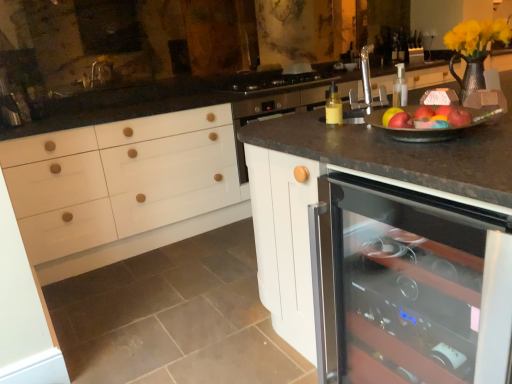
Question: Does red matte apple at upper right, the 1th apple from the right, have a greater height compared to black glass gas stove at center?

Choices:
 (A) yes
 (B) no

Answer: (B)

Question: Is red matte apple at upper right, the 1th apple from the right, to the left of black glass gas stove at center from the viewer's perspective?

Choices:
 (A) yes
 (B) no

Answer: (B)

Question: Considering the relative sizes of red matte apple at upper right, the 1th apple from the right, and black glass gas stove at center in the image provided, is red matte apple at upper right, the 1th apple from the right, wider than black glass gas stove at center?

Choices:
 (A) yes
 (B) no

Answer: (B)

Question: Is red matte apple at upper right, the 3th apple in the left-to-right sequence, next to black glass gas stove at center and touching it?

Choices:
 (A) no
 (B) yes

Answer: (A)

Question: Considering the relative sizes of red matte apple at upper right, the 1th apple from the right, and black glass gas stove at center in the image provided, is red matte apple at upper right, the 1th apple from the right, shorter than black glass gas stove at center?

Choices:
 (A) yes
 (B) no

Answer: (A)

Question: Which is correct: red matte apple at upper right, the 3th apple viewed from the right, is inside red matte apple at right, marked as the 2th apple in a left-to-right arrangement, or outside of it?

Choices:
 (A) inside
 (B) outside

Answer: (B)

Question: In terms of height, does red matte apple at upper right, the 3th apple viewed from the right, look taller or shorter compared to red matte apple at right, which is the 2th apple in right-to-left order?

Choices:
 (A) short
 (B) tall

Answer: (A)

Question: In the image, is red matte apple at upper right, arranged as the first apple when viewed from the left, on the left side or the right side of red matte apple at right, which is the 2th apple in right-to-left order?

Choices:
 (A) right
 (B) left

Answer: (B)

Question: Relative to red matte apple at right, marked as the 2th apple in a left-to-right arrangement, is red matte apple at upper right, the 3th apple viewed from the right, in front or behind?

Choices:
 (A) front
 (B) behind

Answer: (A)

Question: Is red matte apple at right, marked as the 2th apple in a left-to-right arrangement, taller or shorter than yellow matte flower at upper right?

Choices:
 (A) short
 (B) tall

Answer: (A)

Question: In the image, is red matte apple at right, which is the 2th apple in right-to-left order, positioned in front of or behind yellow matte flower at upper right?

Choices:
 (A) front
 (B) behind

Answer: (A)

Question: From a real-world perspective, is red matte apple at right, marked as the 2th apple in a left-to-right arrangement, physically located above or below yellow matte flower at upper right?

Choices:
 (A) below
 (B) above

Answer: (A)

Question: In the image, is red matte apple at right, marked as the 2th apple in a left-to-right arrangement, on the left side or the right side of yellow matte flower at upper right?

Choices:
 (A) right
 (B) left

Answer: (B)

Question: Is red matte apple at upper right, the 1th apple from the right, taller or shorter than yellow matte flower at upper right?

Choices:
 (A) short
 (B) tall

Answer: (A)

Question: Does point (456, 112) appear closer or farther from the camera than point (496, 21)?

Choices:
 (A) farther
 (B) closer

Answer: (B)